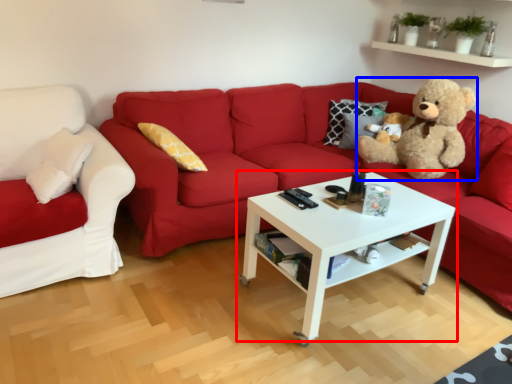
Question: Which of the following is the closest to the observer, coffee table (highlighted by a red box) or teddy bear (highlighted by a blue box)?

Choices:
 (A) coffee table
 (B) teddy bear

Answer: (A)